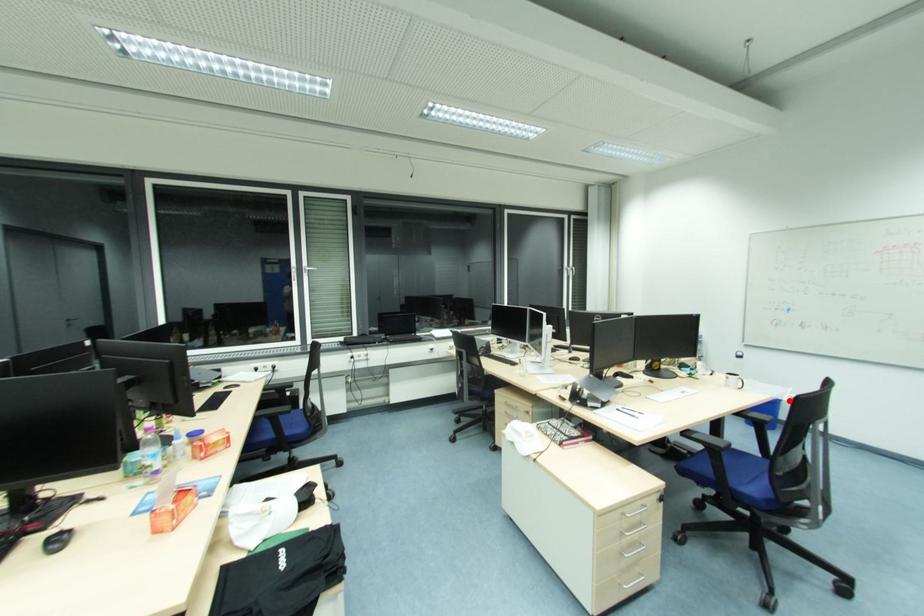
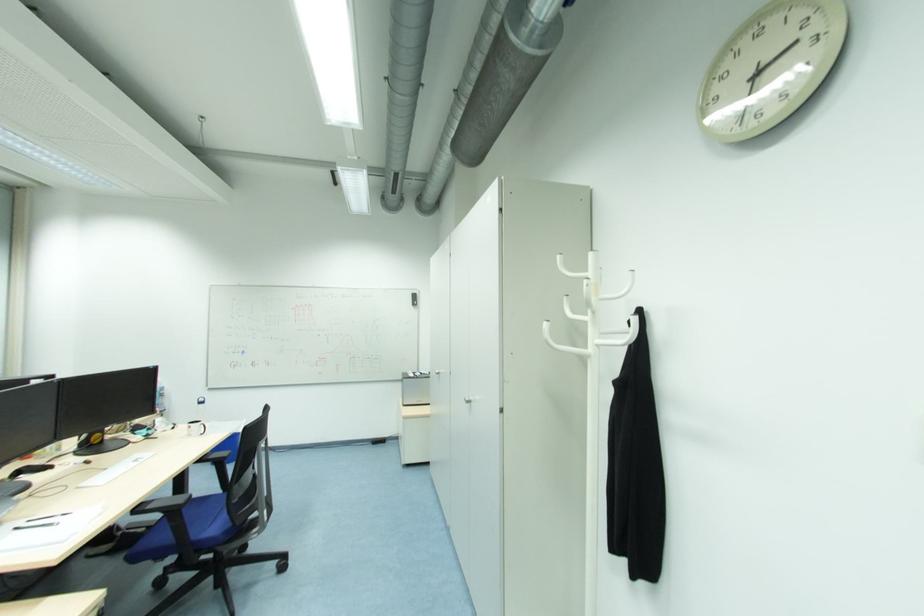
Question: A red point is marked in image1. In image2, is the corresponding 3D point closer to the camera or farther? Reply with the corresponding letter.

Choices:
 (A) The corresponding 3D point is closer.
 (B) The corresponding 3D point is farther.

Answer: (B)